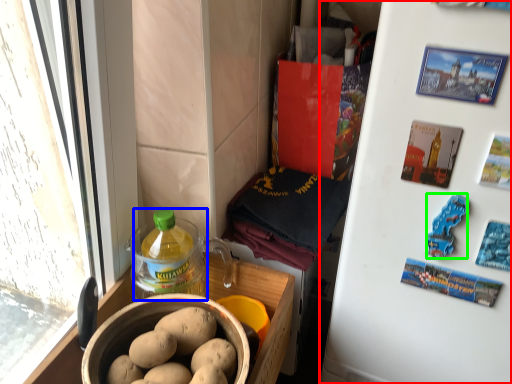
Question: Which object is the closest to the refrigerator (highlighted by a red box)? Choose among these: bottle (highlighted by a blue box) or food (highlighted by a green box).

Choices:
 (A) bottle
 (B) food

Answer: (B)